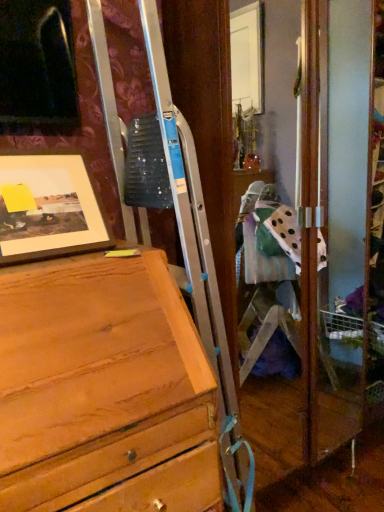
The image size is (384, 512). Identify the location of matte wooden picture frame at upper left. tap(47, 208).

This screenshot has height=512, width=384. Describe the element at coordinates (47, 208) in the screenshot. I see `matte wooden picture frame at upper left` at that location.

In order to face matte wooden picture frame at upper left, should I rotate leftwards or rightwards?

Turn left by 18.110 degrees to look at matte wooden picture frame at upper left.

Find the location of `matte wooden picture frame at upper left`. matte wooden picture frame at upper left is located at coordinates (47, 208).